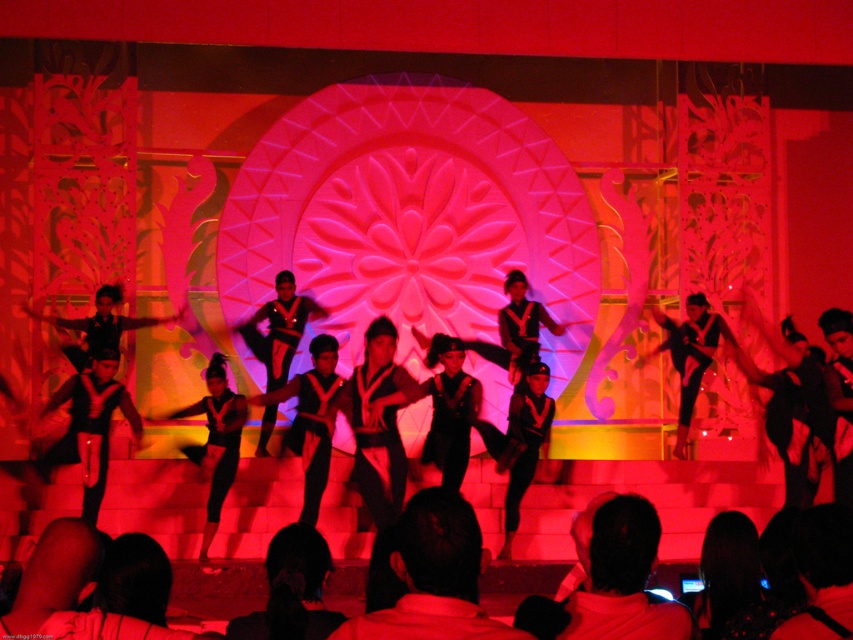
You are a stagehand who needs to adjust the lighting to focus on the dancer wearing the black fabric pants at center and the black fabric shirt at center. Since both are at the center, how can you determine which one is closer to the front?

The black fabric pants at center is in front of the black fabric shirt at center, so the pants are closer to the front and would be more visible under the lighting.

You are a stage designer observing the performance. You notice a point at coordinates (433, 577) on the stage. What object is located at this point?

The point at coordinates (433, 577) corresponds to the black fabric pants at center.